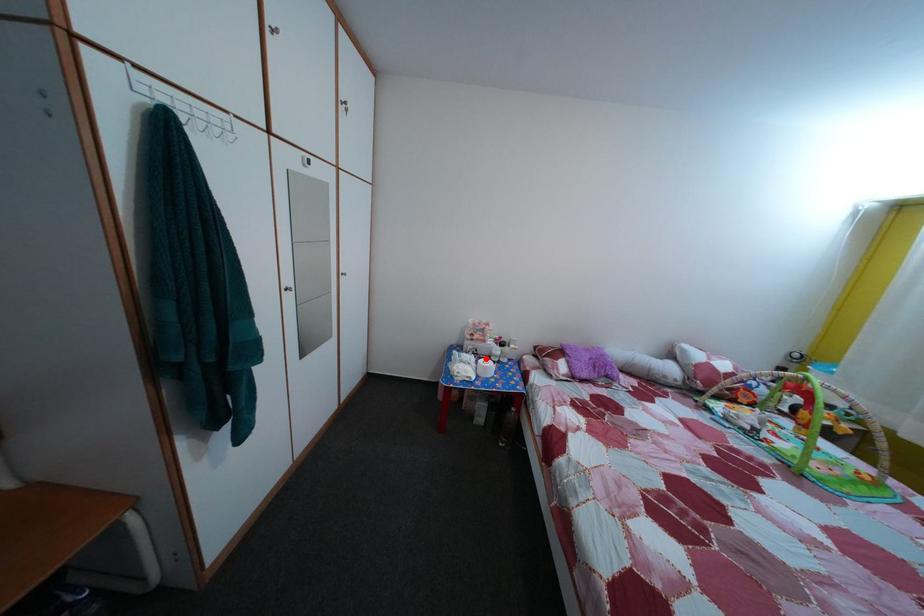
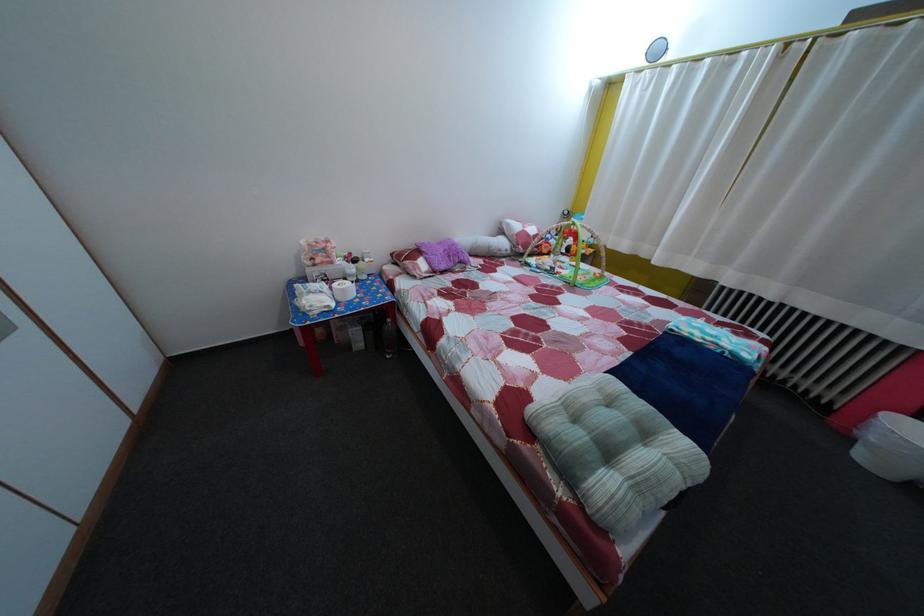
Question: I am providing you with two images of the same scene from different viewpoints. A red point is marked on the first image. Can you still see the location of the red point in image 2?

Choices:
 (A) Yes
 (B) No

Answer: (A)